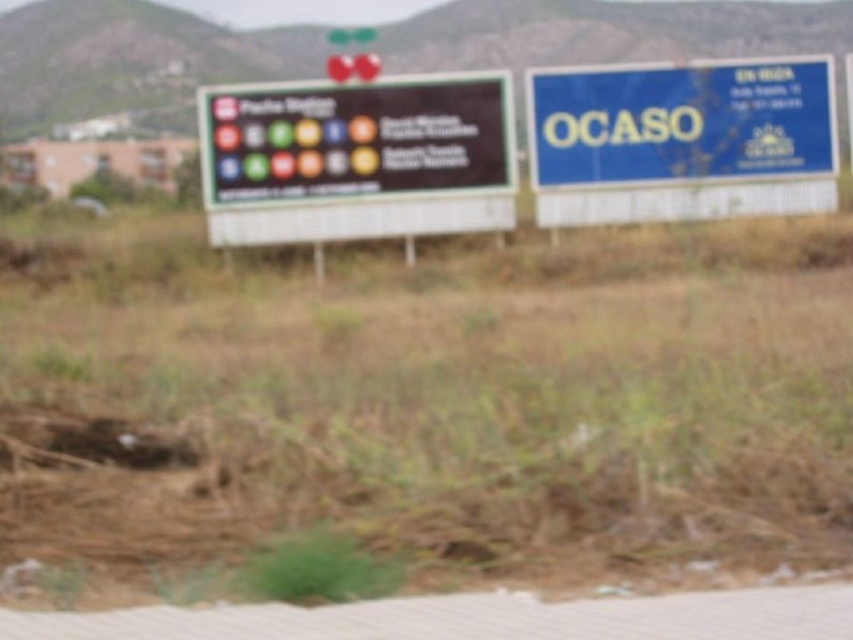
You are driving and see a black matte sign at center and a blue plastic signboard at upper right. Which one is positioned to the left?

The black matte sign at center is positioned to the left of the blue plastic signboard at upper right.

You are a delivery driver who needs to read the text on both the black matte sign at center and the blue plastic signboard at upper right. Which sign is narrower in width?

The black matte sign at center is thinner than the blue plastic signboard at upper right, so it is narrower in width.

You are driving a car that is 4 meters long and need to park between the black matte sign at center and the blue plastic signboard at upper right. Can your car fit in the space between them?

The black matte sign at center and blue plastic signboard at upper right are 7.06 meters apart from each other. Since your car is 4 meters long, it can fit in the space between them as 7.06 meters is greater than 4 meters.